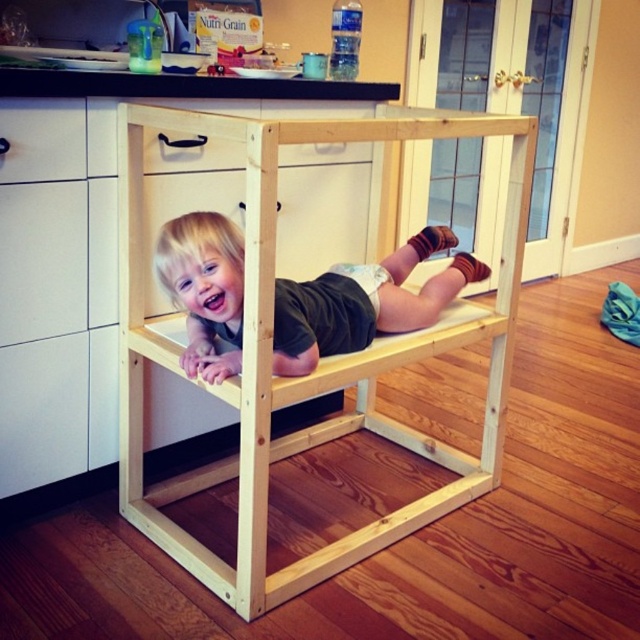
Does matte black toddler at center appear on the left side of white matte drawer at upper left?

Incorrect, matte black toddler at center is not on the left side of white matte drawer at upper left.

Who is shorter, matte black toddler at center or white matte drawer at upper left?

Standing shorter between the two is white matte drawer at upper left.

Where is `matte black toddler at center`? matte black toddler at center is located at coordinates (364, 301).

Can you confirm if natural wood step stool at center is positioned to the right of matte black toddler at center?

Incorrect, natural wood step stool at center is not on the right side of matte black toddler at center.

Which is more to the left, natural wood step stool at center or matte black toddler at center?

natural wood step stool at center is more to the left.

Does point (436, 493) lie in front of point (464, 257)?

Yes, point (436, 493) is closer to viewer.

The width and height of the screenshot is (640, 640). What are the coordinates of `natural wood step stool at center` in the screenshot? It's located at (317, 360).

Between natural wood step stool at center and white matte drawer at upper left, which one is positioned higher?

white matte drawer at upper left

Is point (365, 397) positioned behind point (64, 129)?

Yes, it is.

Find the location of a particular element. natural wood step stool at center is located at coordinates (317, 360).

At what (x,y) coordinates should I click in order to perform the action: click on natural wood step stool at center. Please return your answer as a coordinate pair (x, y). This screenshot has width=640, height=640. Looking at the image, I should click on (317, 360).